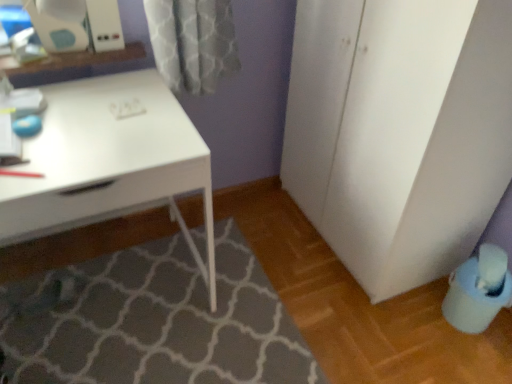
Question: Is there a large distance between white glossy desk at upper left and white matte cabinet at right?

Choices:
 (A) yes
 (B) no

Answer: (B)

Question: Is white glossy desk at upper left thinner than white matte cabinet at right?

Choices:
 (A) yes
 (B) no

Answer: (B)

Question: Considering the relative positions of white glossy desk at upper left and white matte cabinet at right in the image provided, is white glossy desk at upper left to the left of white matte cabinet at right from the viewer's perspective?

Choices:
 (A) yes
 (B) no

Answer: (A)

Question: Does white glossy desk at upper left have a larger size compared to white matte cabinet at right?

Choices:
 (A) yes
 (B) no

Answer: (B)

Question: From a real-world perspective, does white glossy desk at upper left stand above white matte cabinet at right?

Choices:
 (A) yes
 (B) no

Answer: (B)

Question: Would you say blue plastic swivel chair at lower right is to the left or to the right of white matte cabinet at right in the picture?

Choices:
 (A) left
 (B) right

Answer: (B)

Question: Do you think blue plastic swivel chair at lower right is within white matte cabinet at right, or outside of it?

Choices:
 (A) inside
 (B) outside

Answer: (B)

Question: Relative to white matte cabinet at right, is blue plastic swivel chair at lower right in front or behind?

Choices:
 (A) behind
 (B) front

Answer: (A)

Question: From a real-world perspective, is blue plastic swivel chair at lower right positioned above or below white matte cabinet at right?

Choices:
 (A) below
 (B) above

Answer: (A)

Question: Is blue plastic swivel chair at lower right wider or thinner than gray textured bath mat at lower center?

Choices:
 (A) thin
 (B) wide

Answer: (A)

Question: Is blue plastic swivel chair at lower right in front of or behind gray textured bath mat at lower center in the image?

Choices:
 (A) behind
 (B) front

Answer: (A)

Question: Considering the positions of blue plastic swivel chair at lower right and gray textured bath mat at lower center in the image, is blue plastic swivel chair at lower right taller or shorter than gray textured bath mat at lower center?

Choices:
 (A) tall
 (B) short

Answer: (A)

Question: From a real-world perspective, is blue plastic swivel chair at lower right physically located above or below gray textured bath mat at lower center?

Choices:
 (A) above
 (B) below

Answer: (A)

Question: Considering the positions of point (71, 196) and point (401, 39), is point (71, 196) closer or farther from the camera than point (401, 39)?

Choices:
 (A) closer
 (B) farther

Answer: (A)

Question: In terms of width, does white glossy desk at upper left look wider or thinner when compared to white matte cabinet at right?

Choices:
 (A) wide
 (B) thin

Answer: (A)